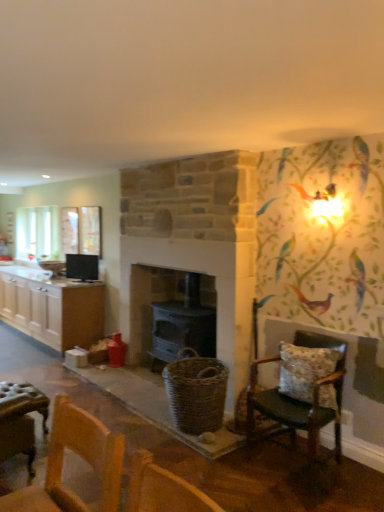
Question: Considering the relative positions of white wood cabinets at left and floral fabric cushioned chair at right in the image provided, is white wood cabinets at left to the left or to the right of floral fabric cushioned chair at right?

Choices:
 (A) right
 (B) left

Answer: (B)

Question: Is white wood cabinets at left taller or shorter than floral fabric cushioned chair at right?

Choices:
 (A) tall
 (B) short

Answer: (B)

Question: Which is farther from the fluffy fabric pillow at right?

Choices:
 (A) white wood cabinets at left
 (B) matte black stove at center
 (C) floral fabric cushioned chair at right
 (D) black glossy monitor at upper left

Answer: (A)

Question: Which is nearer to the floral fabric cushioned chair at right?

Choices:
 (A) matte black stove at center
 (B) fluffy fabric pillow at right
 (C) white wood cabinets at left
 (D) black glossy monitor at upper left

Answer: (B)